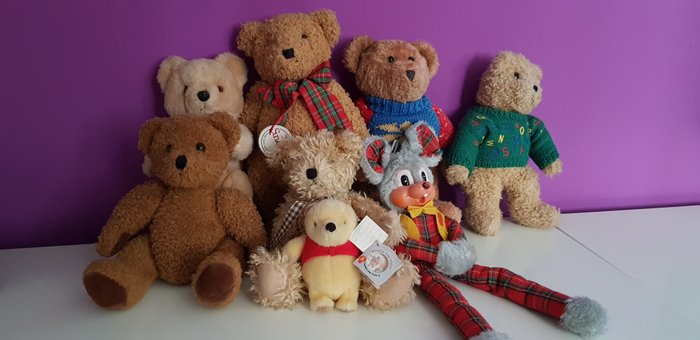
The width and height of the screenshot is (700, 340). What are the coordinates of `stuffed animals` in the screenshot? It's located at (203, 222), (204, 76), (281, 46), (395, 63), (516, 96), (318, 166), (322, 260), (404, 178).